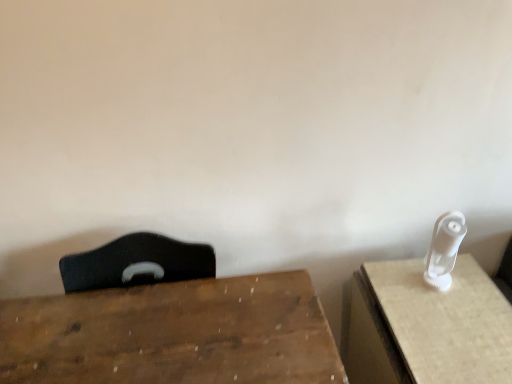
I want to click on free space to the right of white plastic wii controller at right, so click(475, 291).